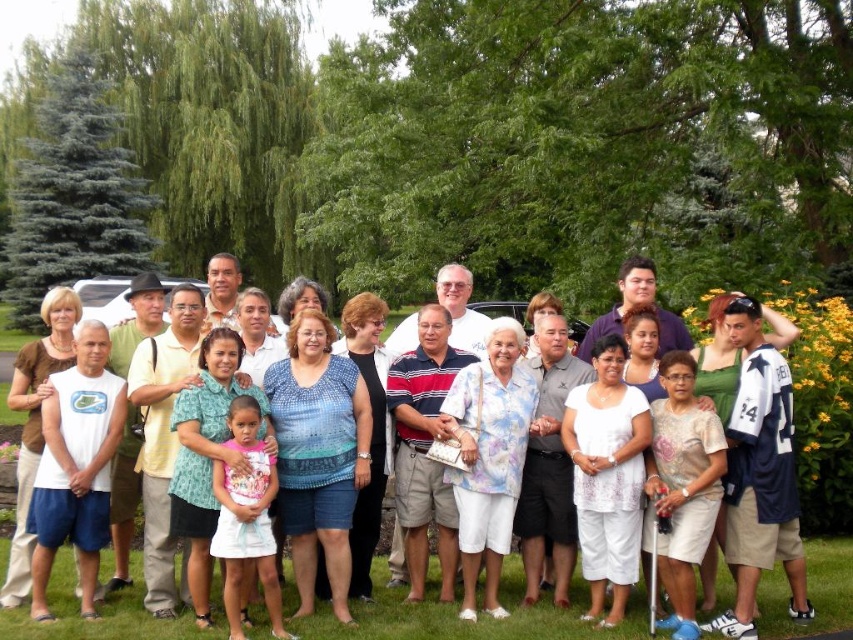
Question: Is white fabric golf course at lower center thinner than white cotton shirt at center?

Choices:
 (A) no
 (B) yes

Answer: (B)

Question: From the image, what is the correct spatial relationship of white fabric golf course at lower center in relation to white cotton shirt at center?

Choices:
 (A) above
 (B) below

Answer: (B)

Question: Which object appears farthest from the camera in this image?

Choices:
 (A) white cotton shirt at center
 (B) white fabric golf course at lower center

Answer: (B)

Question: Is white fabric golf course at lower center smaller than white cotton shirt at center?

Choices:
 (A) no
 (B) yes

Answer: (B)

Question: Which object appears farthest from the camera in this image?

Choices:
 (A) white cotton shirt at center
 (B) white fabric golf course at lower center

Answer: (B)